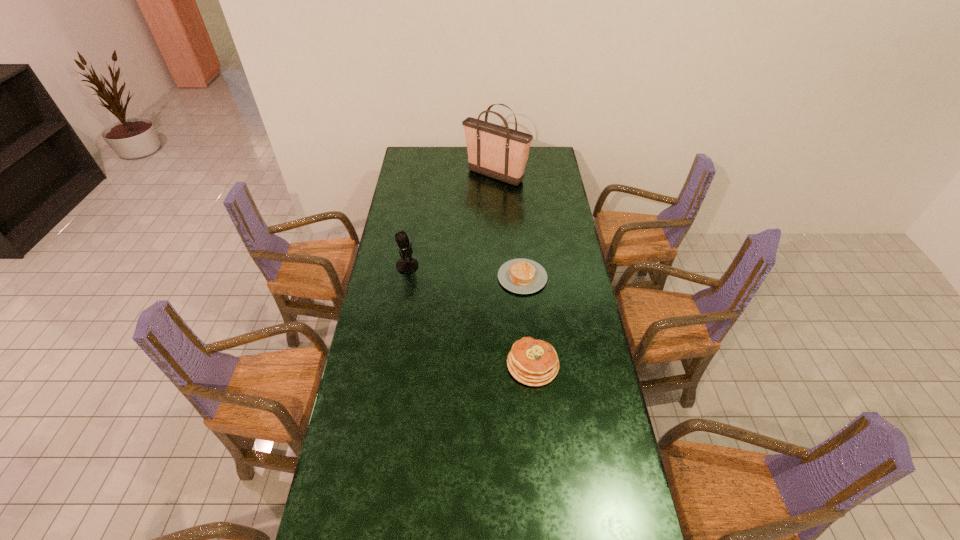
The height and width of the screenshot is (540, 960). In order to click on shopping bag in this screenshot , I will do `click(499, 152)`.

Identify the location of the farthest object. The image size is (960, 540). (499, 152).

At what (x,y) coordinates should I click in order to perform the action: click on microphone. Please return your answer as a coordinate pair (x, y). Image resolution: width=960 pixels, height=540 pixels. Looking at the image, I should click on (407, 264).

The height and width of the screenshot is (540, 960). I want to click on the third shortest object, so click(x=407, y=264).

Locate an element on the screen. The width and height of the screenshot is (960, 540). the taller pancake is located at coordinates (532, 362).

Where is `the third tallest object`? This screenshot has height=540, width=960. the third tallest object is located at coordinates (532, 362).

The width and height of the screenshot is (960, 540). I want to click on the shortest object, so click(522, 276).

Image resolution: width=960 pixels, height=540 pixels. In order to click on the farther pancake in this screenshot , I will do `click(522, 276)`.

Locate an element on the screen. vacant region located on the back of the tallest object is located at coordinates (494, 152).

This screenshot has height=540, width=960. Identify the location of vacant space located 0.300m on the back of the microphone. (416, 215).